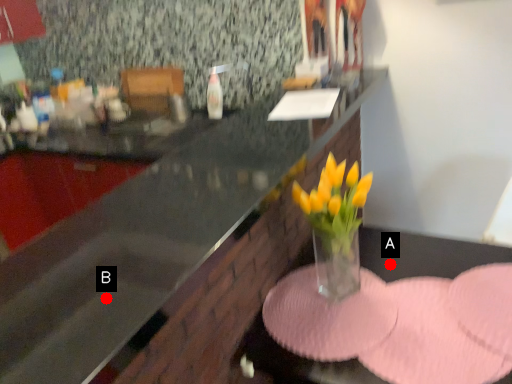
Question: Two points are circled on the image, labeled by A and B beside each circle. Which point is closer to the camera?

Choices:
 (A) A is closer
 (B) B is closer

Answer: (B)